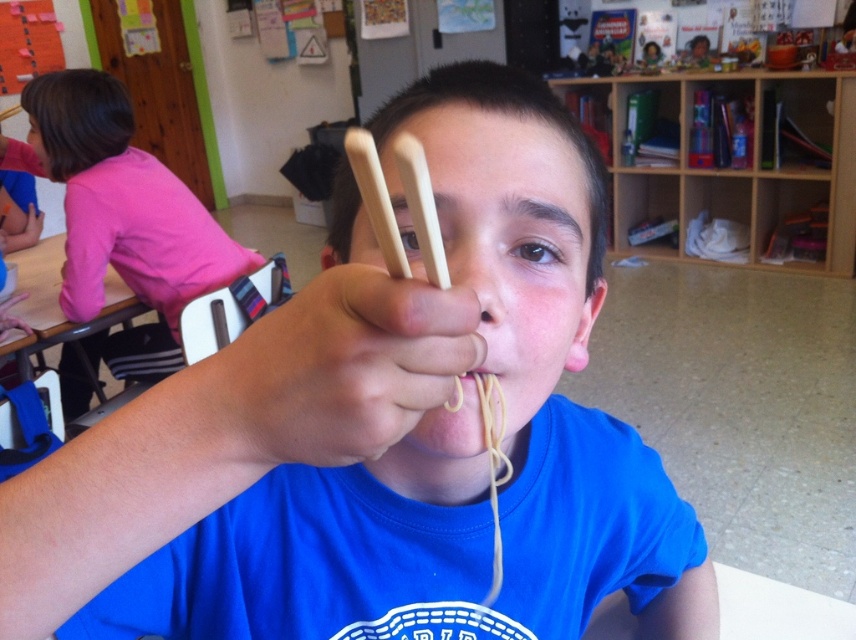
You are a student in the classroom and want to grab the wooden chopsticks at center to eat the yellow matte spaghetti at center. Which one should you reach for first?

You should reach for the wooden chopsticks at center first since it is closer to you than the yellow matte spaghetti at center.

In the classroom scene, you notice the wooden chopsticks at center and the pink fabric shirt at upper left. Which object is smaller in size?

The wooden chopsticks at center are smaller than the pink fabric shirt at upper left.